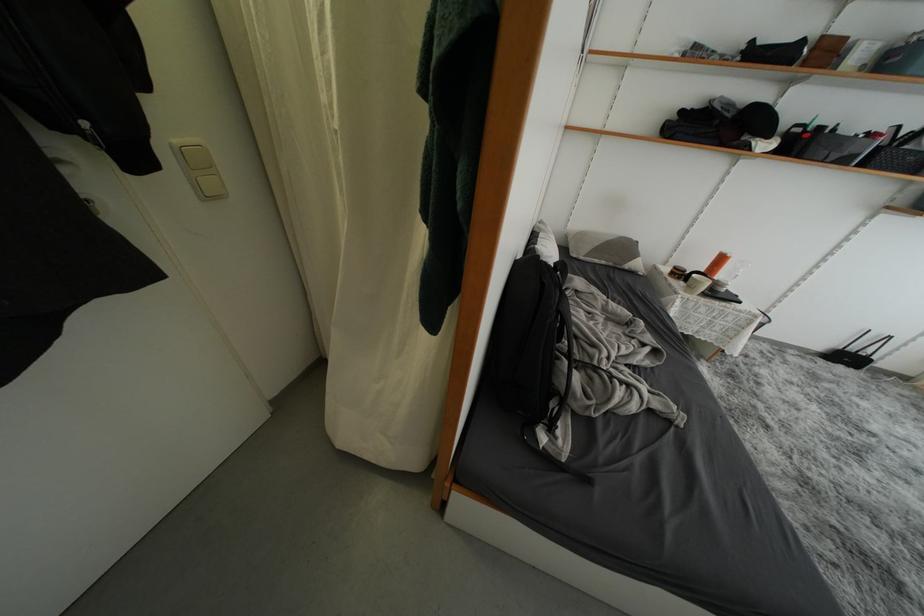
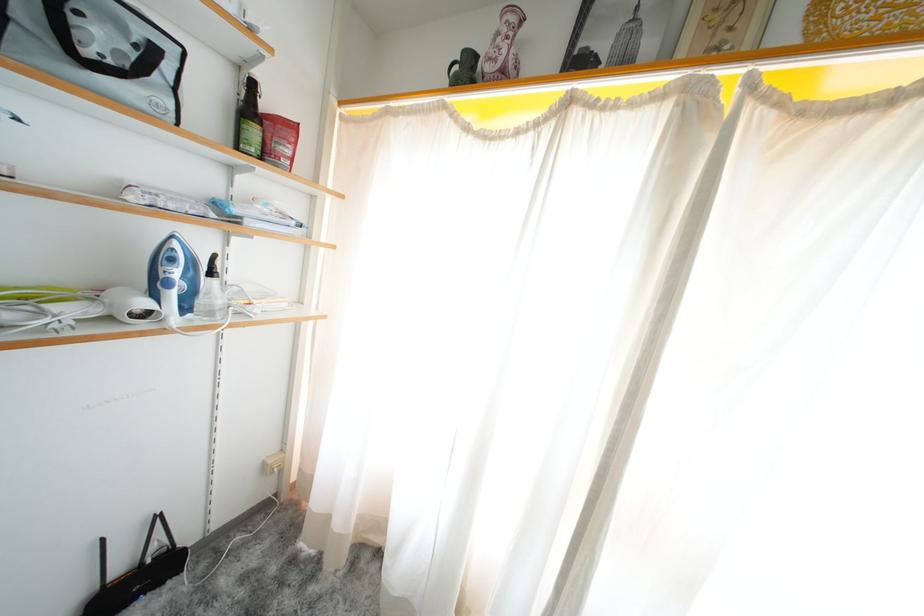
Locate, in the second image, the point that corresponds to pixel 854 362 in the first image.

(143, 586)